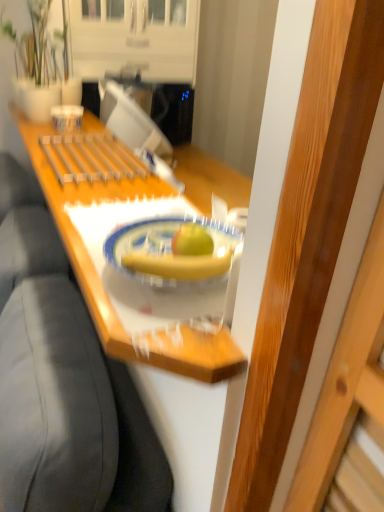
Where is `free spot in front of yellow matte banana at center`? free spot in front of yellow matte banana at center is located at coordinates (184, 328).